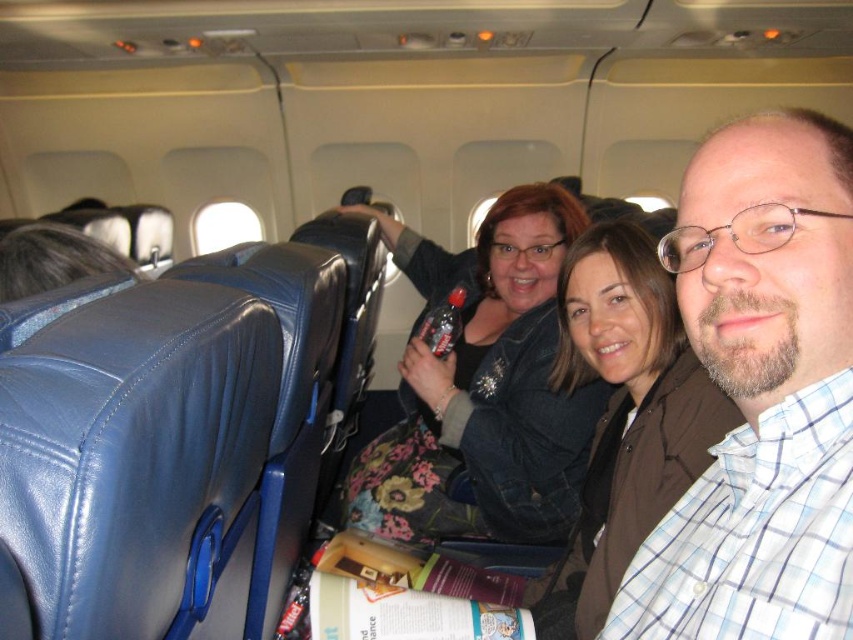
Can you confirm if floral-patterned jacket at center is shorter than brown leather jacket at center?

No, floral-patterned jacket at center is not shorter than brown leather jacket at center.

Does floral-patterned jacket at center have a greater height compared to brown leather jacket at center?

Correct, floral-patterned jacket at center is much taller as brown leather jacket at center.

Locate an element on the screen. floral-patterned jacket at center is located at coordinates (489, 397).

Locate an element on the screen. The height and width of the screenshot is (640, 853). floral-patterned jacket at center is located at coordinates (489, 397).

Who is more distant from viewer, (799, 324) or (548, 433)?

The point (548, 433) is more distant.

Which of these two, plaid shirt at center or floral-patterned jacket at center, stands shorter?

→ plaid shirt at center is shorter.

Does point (758, 440) lie in front of point (577, 435)?

Yes, point (758, 440) is closer to viewer.

Locate an element on the screen. The width and height of the screenshot is (853, 640). plaid shirt at center is located at coordinates (761, 394).

Is plaid shirt at center taller than brown leather jacket at center?

No.

Where is `plaid shirt at center`? plaid shirt at center is located at coordinates (761, 394).